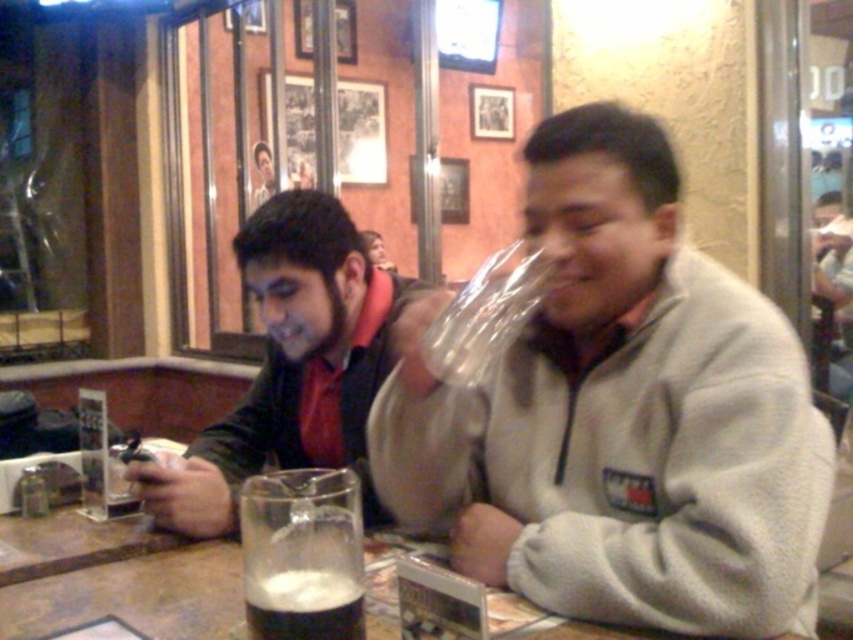
Question: Estimate the real-world distances between objects in this image. Which object is closer to the foamy dark liquid at lower center?

Choices:
 (A) gray fleece jacket at center
 (B) foamy dark liquid at center

Answer: (B)

Question: Does matte black phone at left appear over foamy dark liquid at lower center?

Choices:
 (A) no
 (B) yes

Answer: (B)

Question: Which point appears farthest from the camera in this image?

Choices:
 (A) pyautogui.click(x=288, y=573)
 (B) pyautogui.click(x=711, y=499)
 (C) pyautogui.click(x=291, y=624)
 (D) pyautogui.click(x=254, y=227)

Answer: (D)

Question: Is matte black phone at left bigger than foamy dark liquid at center?

Choices:
 (A) no
 (B) yes

Answer: (B)

Question: Does gray fleece jacket at center have a lesser width compared to foamy dark liquid at lower center?

Choices:
 (A) yes
 (B) no

Answer: (B)

Question: Which of these objects is positioned farthest from the gray fleece jacket at center?

Choices:
 (A) matte black phone at left
 (B) foamy dark liquid at lower center
 (C) foamy dark liquid at center

Answer: (B)